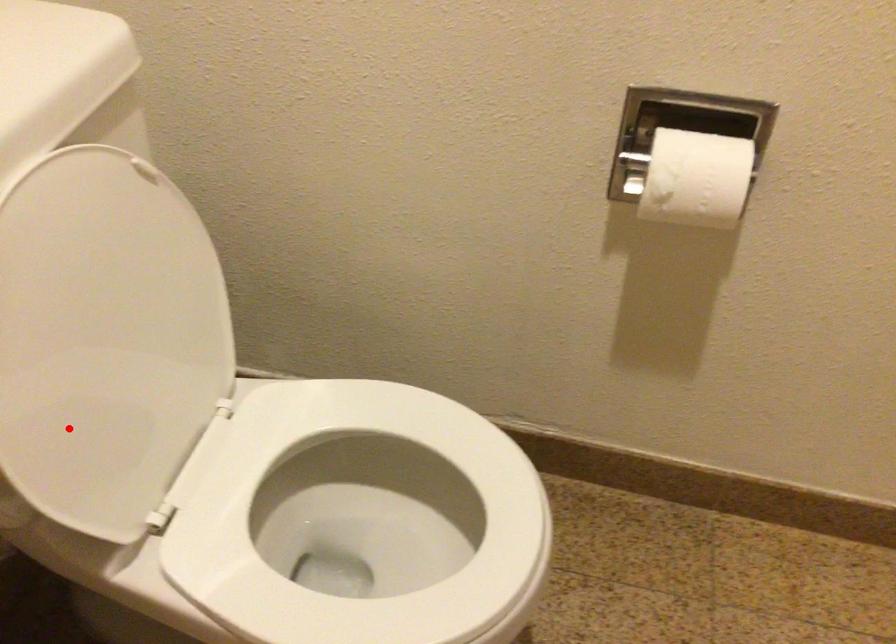
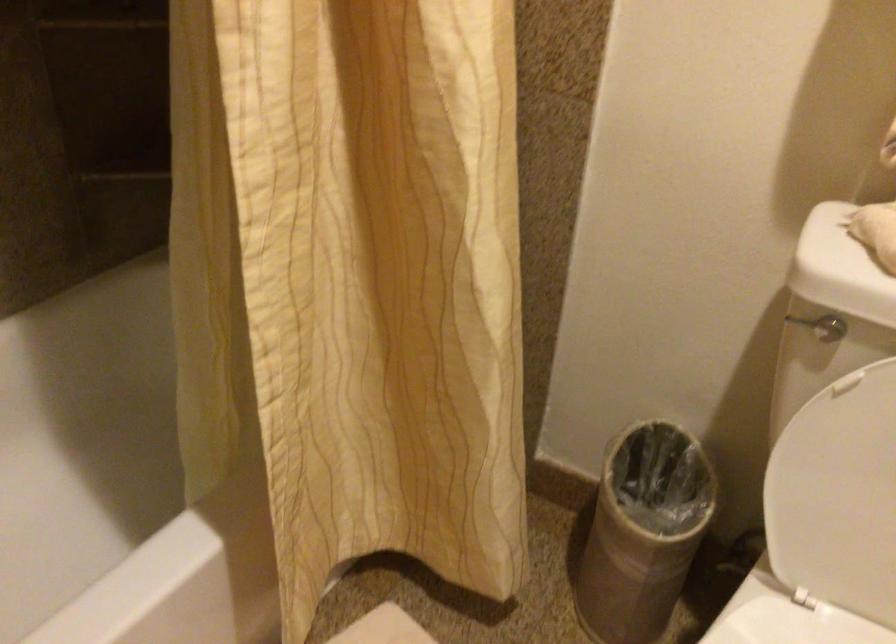
Question: I am providing you with two images of the same scene from different viewpoints. Given a red point in image1, look at the same physical point in image2. Is it:

Choices:
 (A) Closer to the viewpoint
 (B) Farther from the viewpoint

Answer: (B)